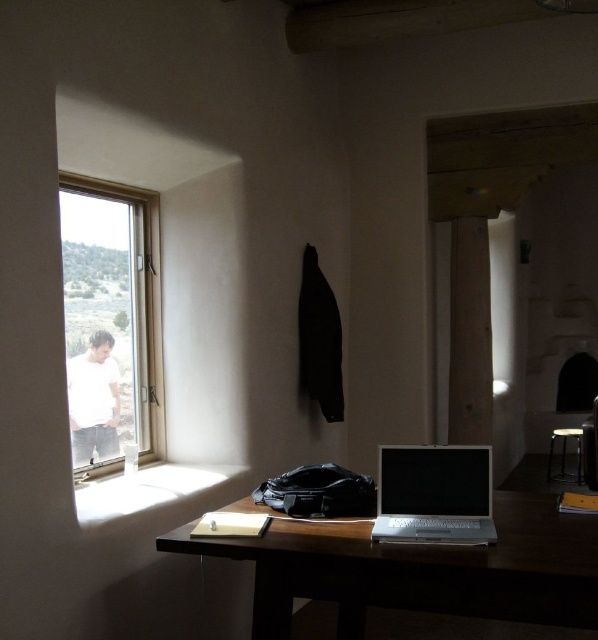
You are trying to move a large painting that is 2 meters wide into the room through the clear glass window at left. Based on the scene, can the painting fit through the window? Please consider the dimensions of the wooden table at center as well.

The wooden table at center might be wider than the clear glass window at left, so there is a possibility that the painting cannot fit through the window if the window is narrower than the painting. However, without exact measurements, it is uncertain. Consider measuring the window width before attempting to move the painting.

You are standing at the origin point in a room and see two points marked in the image. Which point is closer to you, point (155,200) or point (481,529)?

Point (481,529) is closer to you because it is in front of point (155,200).

You are sitting at the silver metallic laptop at center and want to look outside through the clear glass window at left. Can you see the window from your current position?

The clear glass window at left is positioned over the silver metallic laptop at center, so yes, you can see the window from your current position.